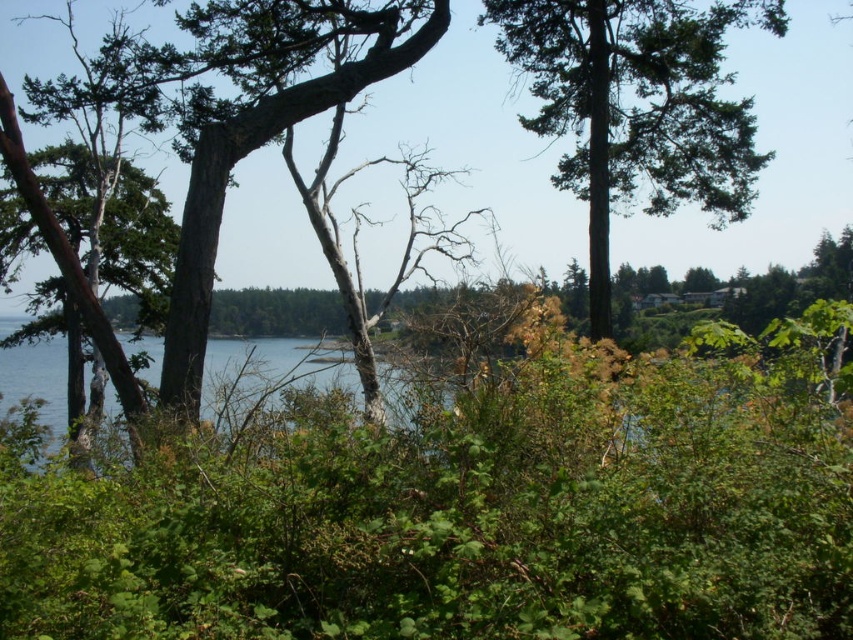
You are standing in a natural landscape and see the green rough bark tree at center and the blue water at center. Which object is located to the right of the other?

The green rough bark tree at center is positioned on the right side of blue water at center.

You are a hiker trying to cross the blue water at center. There is a green rough bark tree at center nearby. Which object would you use to check the depth of the water?

The green rough bark tree at center is thinner than the blue water at center, so the tree might not be sturdy enough to use for checking water depth. Instead, you should use a more stable object, but since only these two are available, the blue water at center is the water body, so the question is not directly answerable with the given objects. However, based on the description, the tree is thinner, implying it might not be reliable. Perhaps the water depth can be judged by other means not mentioned here.

You are a botanist observing the two trees at the center of the scene. Which tree has a greater width between the green textured tree at center and the green rough bark tree at center?

The green textured tree at center has a greater width than the green rough bark tree at center according to the description.